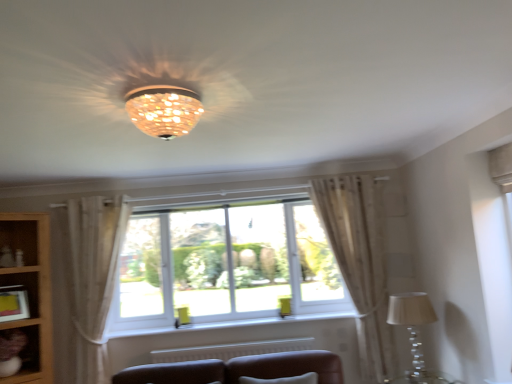
Identify the location of translucent glass table lamp at lower right. click(x=413, y=332).

This screenshot has width=512, height=384. What do you see at coordinates (13, 304) in the screenshot?
I see `matte yellow picture frame at lower left` at bounding box center [13, 304].

At what (x,y) coordinates should I click in order to perform the action: click on matte glass chandelier at center. Please return your answer as a coordinate pair (x, y). This screenshot has height=384, width=512. Looking at the image, I should click on (164, 109).

This screenshot has height=384, width=512. What are the coordinates of `white plastic window sill at center` in the screenshot? It's located at (232, 323).

How far apart are sheer beige curtain at right, the first curtain viewed from the right, and white plastic window at center?

A distance of 31.96 inches exists between sheer beige curtain at right, the first curtain viewed from the right, and white plastic window at center.

Is sheer beige curtain at right, the first curtain viewed from the right, inside or outside of white plastic window at center?

sheer beige curtain at right, the first curtain viewed from the right, is not enclosed by white plastic window at center.

Is point (334, 246) closer or farther from the camera than point (272, 250)?

Point (334, 246) is positioned closer to the camera compared to point (272, 250).

Is sheer beige curtain at right, which is counted as the 2th curtain, starting from the left, next to white plastic window at center and touching it?

They are not placed beside each other.

This screenshot has height=384, width=512. In order to click on the 1st curtain behind when counting from the matte glass chandelier at center in this screenshot , I will do `click(84, 283)`.

Is matte glass chandelier at center spatially inside sheer beige curtain at lower left, which is the first curtain in left-to-right order, or outside of it?

The correct answer is: outside.

Does matte glass chandelier at center have a smaller size compared to sheer beige curtain at lower left, the second curtain from the right?

Yes.

From a real-world perspective, which object stands above the other?

matte glass chandelier at center.

Are matte brown shelf at lower left and sheer beige curtain at lower left, the second curtain from the right, making contact?

No, matte brown shelf at lower left is not in contact with sheer beige curtain at lower left, the second curtain from the right.

Consider the image. From a real-world perspective, is matte brown shelf at lower left physically above sheer beige curtain at lower left, which is the first curtain in left-to-right order?

No.

Is matte brown shelf at lower left not within sheer beige curtain at lower left, which is the first curtain in left-to-right order?

Indeed, matte brown shelf at lower left is completely outside sheer beige curtain at lower left, which is the first curtain in left-to-right order.

Is matte yellow picture frame at lower left turned away from white plastic window sill at center?

matte yellow picture frame at lower left does not have its back to white plastic window sill at center.

Looking at this image, from a real-world perspective, is matte yellow picture frame at lower left above or below white plastic window sill at center?

matte yellow picture frame at lower left is situated higher than white plastic window sill at center in the real world.

Could you measure the distance between matte yellow picture frame at lower left and white plastic window sill at center?

matte yellow picture frame at lower left is 4.07 feet away from white plastic window sill at center.

Consider the image. Visually, is sheer beige curtain at right, which is counted as the 2th curtain, starting from the left, positioned to the left or to the right of sheer beige curtain at lower left, the second curtain from the right?

sheer beige curtain at right, which is counted as the 2th curtain, starting from the left, is to the right of sheer beige curtain at lower left, the second curtain from the right.

From the image's perspective, is sheer beige curtain at right, which is counted as the 2th curtain, starting from the left, located beneath sheer beige curtain at lower left, which is the first curtain in left-to-right order?

No.

Which of these two, sheer beige curtain at right, which is counted as the 2th curtain, starting from the left, or sheer beige curtain at lower left, which is the first curtain in left-to-right order, stands shorter?

With less height is sheer beige curtain at lower left, which is the first curtain in left-to-right order.

Is sheer beige curtain at right, which is counted as the 2th curtain, starting from the left, next to sheer beige curtain at lower left, which is the first curtain in left-to-right order?

No, sheer beige curtain at right, which is counted as the 2th curtain, starting from the left, is not making contact with sheer beige curtain at lower left, which is the first curtain in left-to-right order.

In the scene shown: Considering the sizes of objects translucent glass table lamp at lower right and white plastic window sill at center in the image provided, who is wider, translucent glass table lamp at lower right or white plastic window sill at center?

translucent glass table lamp at lower right.

Is translucent glass table lamp at lower right positioned with its back to white plastic window sill at center?

No, white plastic window sill at center is not at the back of translucent glass table lamp at lower right.

Is point (413, 297) closer or farther from the camera than point (211, 324)?

Point (413, 297) appears to be closer to the viewer than point (211, 324).

From a real-world perspective, who is located lower, matte yellow picture frame at lower left or matte brown shelf at lower left?

matte brown shelf at lower left.

From their relative heights in the image, would you say matte yellow picture frame at lower left is taller or shorter than matte brown shelf at lower left?

matte yellow picture frame at lower left is shorter than matte brown shelf at lower left.

Is matte yellow picture frame at lower left in contact with matte brown shelf at lower left?

No.

The image size is (512, 384). What are the coordinates of `window above the sheer beige curtain at right, which is counted as the 2th curtain, starting from the left (from a real-world perspective)` in the screenshot? It's located at (226, 265).

Where is `lamp in front of the sheer beige curtain at lower left, the second curtain from the right`? lamp in front of the sheer beige curtain at lower left, the second curtain from the right is located at coordinates (164, 109).

From the image, which object appears to be farther from white plastic window at center, white textured radiator at lower center or white plastic window sill at center?

white textured radiator at lower center.

When comparing their distances from wooden bookshelf at lower left, does matte yellow picture frame at lower left or sheer beige curtain at right, the first curtain viewed from the right, seem further?

Among the two, sheer beige curtain at right, the first curtain viewed from the right, is located further to wooden bookshelf at lower left.

From the image, which object appears to be farther from matte brown shelf at lower left, matte glass chandelier at center or sheer beige curtain at lower left, which is the first curtain in left-to-right order?

Among the two, matte glass chandelier at center is located further to matte brown shelf at lower left.

Which object lies further to the anchor point white plastic window sill at center, wooden bookshelf at lower left or white plastic window at center?

The object further to white plastic window sill at center is wooden bookshelf at lower left.

Estimate the real-world distances between objects in this image. Which object is further from matte brown shelf at lower left, white textured radiator at lower center or wooden bookshelf at lower left?

white textured radiator at lower center is positioned further to the anchor matte brown shelf at lower left.

When comparing their distances from matte brown shelf at lower left, does sheer beige curtain at lower left, the second curtain from the right, or white plastic window sill at center seem further?

white plastic window sill at center.

When comparing their distances from matte brown shelf at lower left, does white textured radiator at lower center or white plastic window sill at center seem further?

white textured radiator at lower center is positioned further to the anchor matte brown shelf at lower left.

Based on their spatial positions, is sheer beige curtain at right, the first curtain viewed from the right, or matte yellow picture frame at lower left closer to matte brown shelf at lower left?

matte yellow picture frame at lower left is positioned closer to the anchor matte brown shelf at lower left.

You are a GUI agent. You are given a task and a screenshot of the screen. Output one action in this format:
    pyautogui.click(x=<x>, y=<y>)
    Task: Click on the radiator between matte yellow picture frame at lower left and sheer beige curtain at right, which is counted as the 2th curtain, starting from the left, from left to right
    This screenshot has width=512, height=384.
    Given the screenshot: What is the action you would take?
    pyautogui.click(x=231, y=350)

Where is `curtain situated between wooden bookshelf at lower left and white plastic window at center from left to right`? curtain situated between wooden bookshelf at lower left and white plastic window at center from left to right is located at coordinates (84, 283).

Identify the location of radiator between white plastic window at center and sheer beige curtain at right, which is counted as the 2th curtain, starting from the left, from left to right. The height and width of the screenshot is (384, 512). (231, 350).

Locate an element on the screen. This screenshot has width=512, height=384. radiator between matte yellow picture frame at lower left and translucent glass table lamp at lower right is located at coordinates (231, 350).